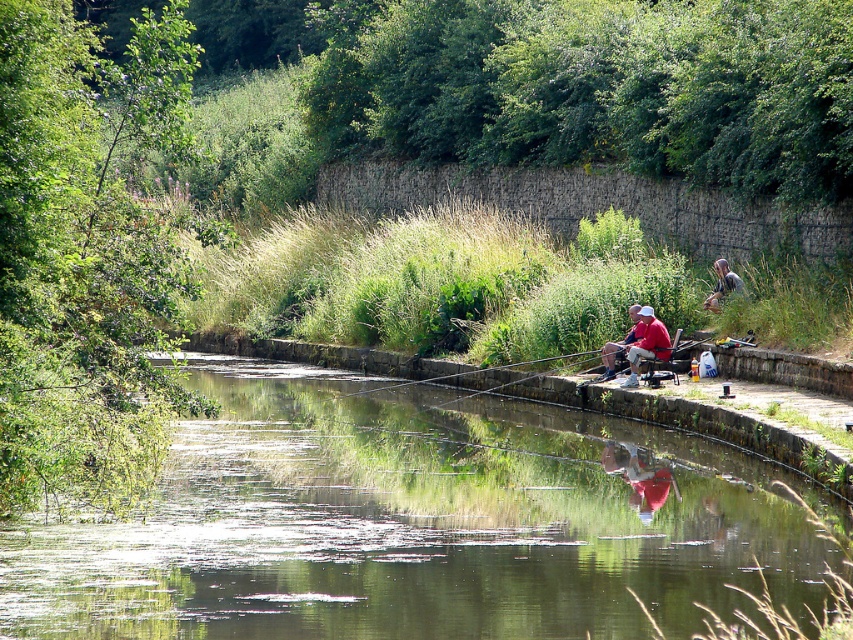
user is a photographer planning to take a photo of the green grassy stream at center and camouflage fabric person at right. The photographer wants to ensure both subjects are in focus. What should they adjust on their camera to achieve this?

To ensure both the green grassy stream at center and the camouflage fabric person at right are in focus, the photographer should increase the depth of field by using a smaller aperture setting. This allows for a greater range of the scene to be sharp and in focus.

You are standing at point (633, 330) and want to walk to the riverbank. Is the point (303, 426) located between you and the river?

Yes, the point (303, 426) is in front of point (633, 330), so it is between you and the riverbank.